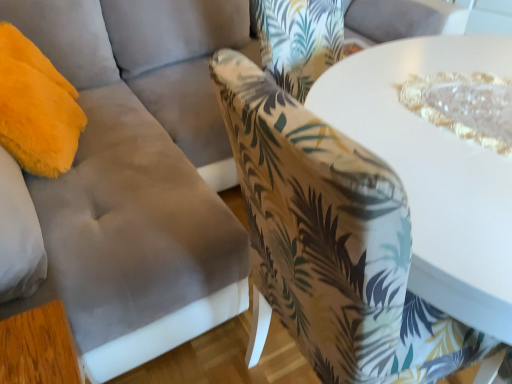
The image size is (512, 384). I want to click on palm-patterned fabric chair at center, so click(x=333, y=241).

Image resolution: width=512 pixels, height=384 pixels. What do you see at coordinates (333, 241) in the screenshot? I see `palm-patterned fabric chair at center` at bounding box center [333, 241].

This screenshot has height=384, width=512. I want to click on palm-patterned fabric chair at center, so click(x=333, y=241).